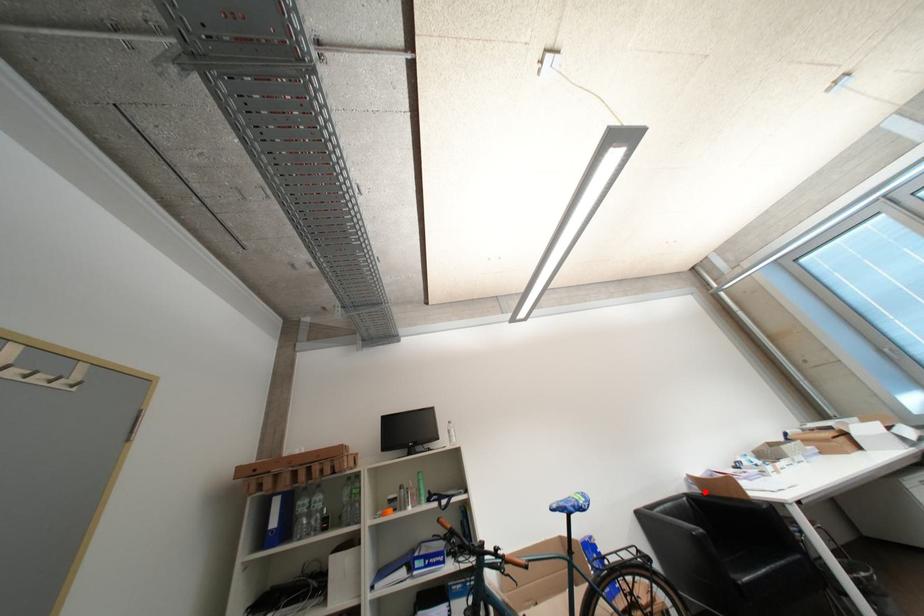
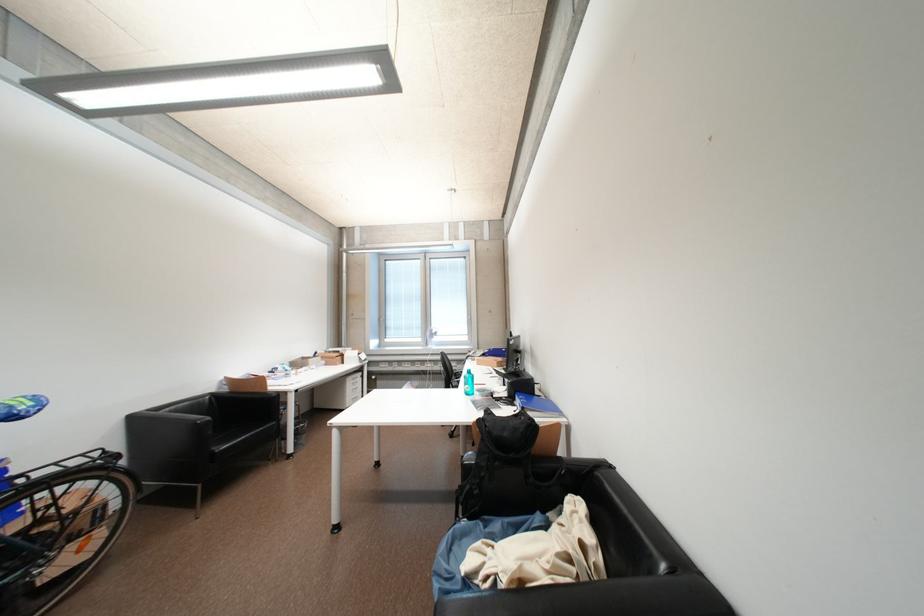
Question: I am providing you with two images of the same scene from different viewpoints. Image1 has a red point marked. In image2, the corresponding 3D location appears at what relative position? Reply with the corresponding letter.

Choices:
 (A) Closer
 (B) Farther

Answer: (B)